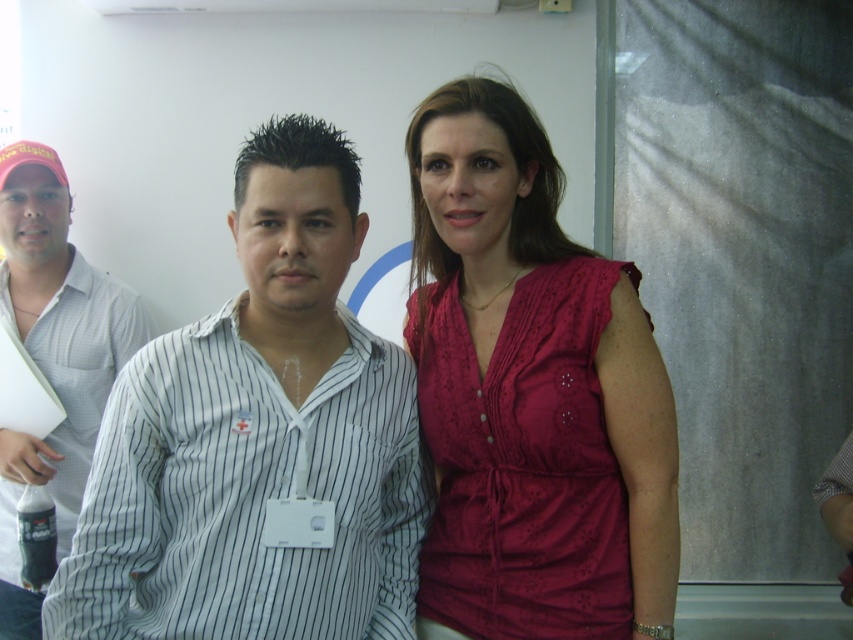
You are a photographer adjusting the camera settings for a group photo. You notice two outfits in the frame, the white striped shirt at center and the matte pink blouse at center. Which outfit is shorter in height?

The white striped shirt at center has a lesser height compared to the matte pink blouse at center, so the white striped shirt at center is shorter in height.